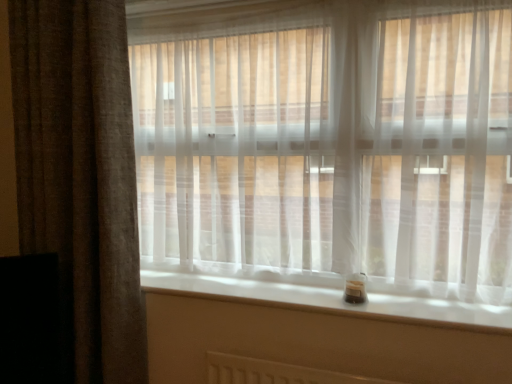
Question: From the image's perspective, does translucent white curtain at center, placed as the 1th curtain when sorted from right to left, appear lower than brown textured curtain at left, arranged as the 2th curtain when viewed from the right?

Choices:
 (A) yes
 (B) no

Answer: (B)

Question: Is translucent white curtain at center, placed as the 1th curtain when sorted from right to left, behind brown textured curtain at left, arranged as the 2th curtain when viewed from the right?

Choices:
 (A) no
 (B) yes

Answer: (A)

Question: Can you confirm if translucent white curtain at center, placed as the 1th curtain when sorted from right to left, is taller than brown textured curtain at left, arranged as the 2th curtain when viewed from the right?

Choices:
 (A) no
 (B) yes

Answer: (A)

Question: From a real-world perspective, is translucent white curtain at center, arranged as the second curtain when viewed from the left, over brown textured curtain at left, acting as the 1th curtain starting from the left?

Choices:
 (A) no
 (B) yes

Answer: (B)

Question: Is translucent white curtain at center, arranged as the second curtain when viewed from the left, positioned beyond the bounds of brown textured curtain at left, acting as the 1th curtain starting from the left?

Choices:
 (A) no
 (B) yes

Answer: (B)

Question: Does point (102, 94) appear closer or farther from the camera than point (440, 317)?

Choices:
 (A) closer
 (B) farther

Answer: (B)

Question: Considering the positions of brown textured curtain at left, arranged as the 2th curtain when viewed from the right, and white smooth window sill at lower center in the image, is brown textured curtain at left, arranged as the 2th curtain when viewed from the right, taller or shorter than white smooth window sill at lower center?

Choices:
 (A) tall
 (B) short

Answer: (A)

Question: Which is correct: brown textured curtain at left, arranged as the 2th curtain when viewed from the right, is inside white smooth window sill at lower center, or outside of it?

Choices:
 (A) outside
 (B) inside

Answer: (A)

Question: Based on their sizes in the image, would you say brown textured curtain at left, arranged as the 2th curtain when viewed from the right, is bigger or smaller than white smooth window sill at lower center?

Choices:
 (A) big
 (B) small

Answer: (A)

Question: From a real-world perspective, is white smooth window sill at lower center above or below translucent white curtain at center, arranged as the second curtain when viewed from the left?

Choices:
 (A) above
 (B) below

Answer: (B)

Question: Considering the positions of white smooth window sill at lower center and translucent white curtain at center, arranged as the second curtain when viewed from the left, in the image, is white smooth window sill at lower center taller or shorter than translucent white curtain at center, arranged as the second curtain when viewed from the left,?

Choices:
 (A) short
 (B) tall

Answer: (A)

Question: Is point (333, 306) positioned closer to the camera than point (332, 203)?

Choices:
 (A) farther
 (B) closer

Answer: (B)

Question: Choose the correct answer: Is white smooth window sill at lower center inside translucent white curtain at center, arranged as the second curtain when viewed from the left, or outside it?

Choices:
 (A) outside
 (B) inside

Answer: (A)

Question: From the image's perspective, is translucent white curtain at center, arranged as the second curtain when viewed from the left, above or below brown textured curtain at left, arranged as the 2th curtain when viewed from the right?

Choices:
 (A) above
 (B) below

Answer: (A)

Question: From a real-world perspective, is translucent white curtain at center, arranged as the second curtain when viewed from the left, positioned above or below brown textured curtain at left, arranged as the 2th curtain when viewed from the right?

Choices:
 (A) below
 (B) above

Answer: (B)